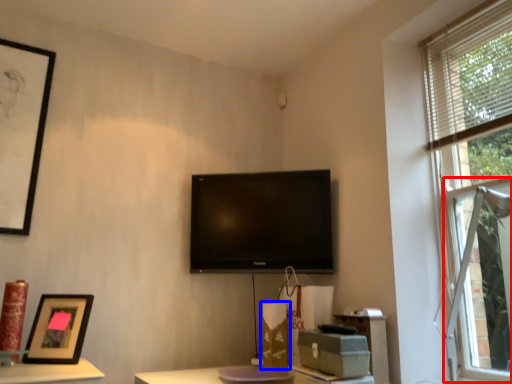
Question: Which object is closer to the camera taking this photo, bay window (highlighted by a red box) or cardboard box (highlighted by a blue box)?

Choices:
 (A) bay window
 (B) cardboard box

Answer: (A)